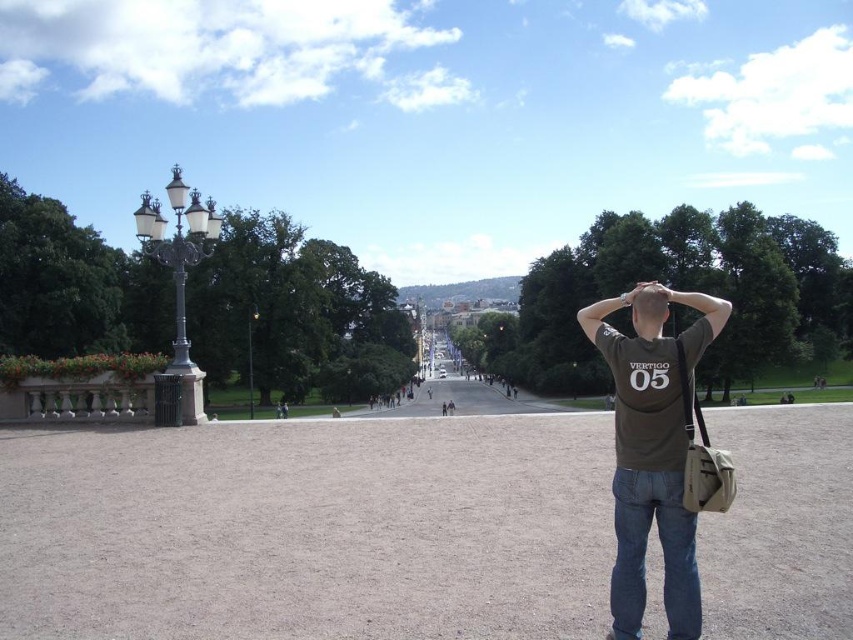
You are standing at the center of the plaza and want to find the polished brass streetlamp at left. Which direction should you look to see it?

The polished brass streetlamp at left is located at the left side of the plaza, so you should look to your left to see it.

You are standing at the entrance of the plaza and want to walk towards the polished brass streetlamp at left. The plaza has a 100 feet long pathway. Can you reach the streetlamp within the plaza without leaving the plaza area?

The distance between the polished brass streetlamp at left and the camera is 61.29 feet, which is less than the 100 feet long pathway. Therefore, you can reach the polished brass streetlamp at left within the plaza without leaving the area.